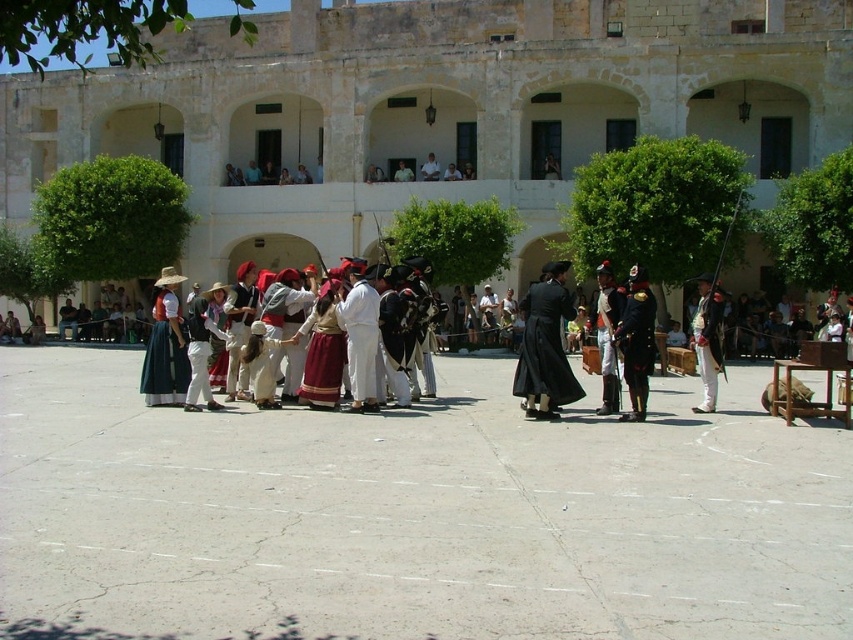
Question: Can you confirm if matte blue skirt at center is positioned below shiny black uniform at center?

Choices:
 (A) yes
 (B) no

Answer: (B)

Question: Which object is positioned closest to the light green fabric shirt at center?

Choices:
 (A) beige stone building at center
 (B) light brown leather jacket at center

Answer: (B)

Question: Where is black velvet coat at center located in relation to light brown leather jacket at center in the image?

Choices:
 (A) right
 (B) left

Answer: (A)

Question: Estimate the real-world distances between objects in this image. Which object is closer to the black velvet coat at center?

Choices:
 (A) beige stone building at center
 (B) light brown leather jacket at center
 (C) white cotton shirt at center

Answer: (C)

Question: Is black velvet coat at center closer to camera compared to shiny black uniform at center?

Choices:
 (A) no
 (B) yes

Answer: (B)

Question: Estimate the real-world distances between objects in this image. Which object is farther from the light brown leather jacket at center?

Choices:
 (A) light green fabric shirt at center
 (B) black velvet coat at center
 (C) white cotton shirt at center

Answer: (C)